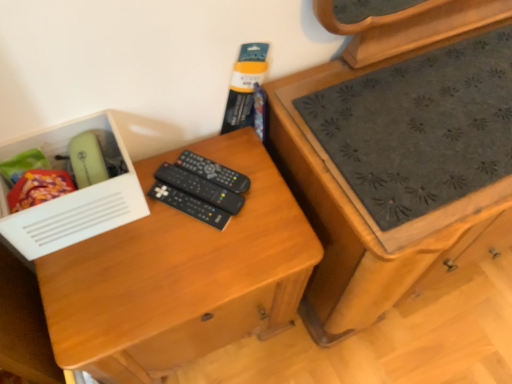
Locate an element on the screen. The width and height of the screenshot is (512, 384). vacant space behind black plastic remote controls at center, acting as the 3th remote control starting from the top is located at coordinates (211, 155).